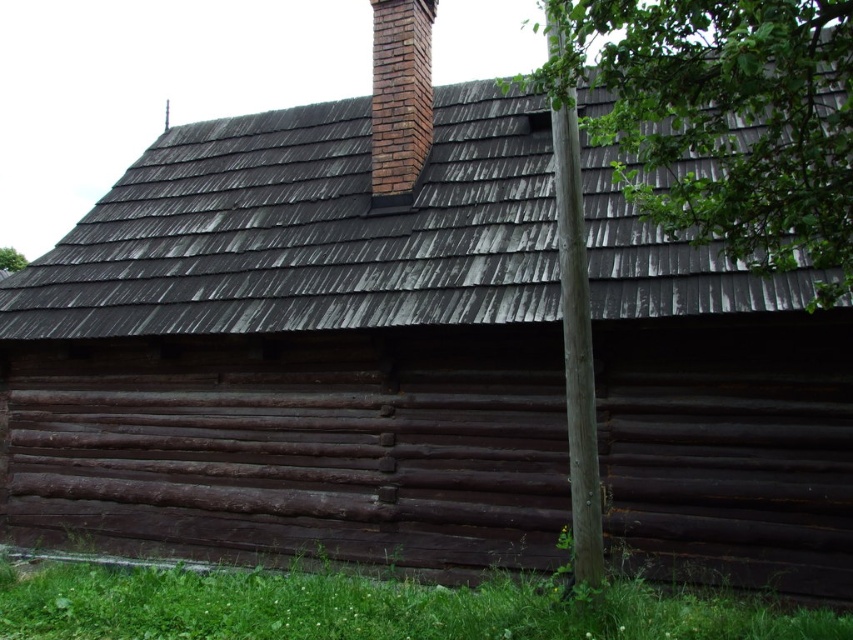
You are standing in front of a rustic wooden cabin with a brick chimney. You notice a point marked at coordinates (722,120). What object is located at this point?

The point at coordinates (722,120) indicates a green leafy tree at upper right.

You are standing in front of the rustic wooden structure and notice a green leafy tree at upper right and a smooth brown pole at center right. Which object is located higher in the scene?

The green leafy tree at upper right is positioned over the smooth brown pole at center right, meaning it is higher up in the scene.